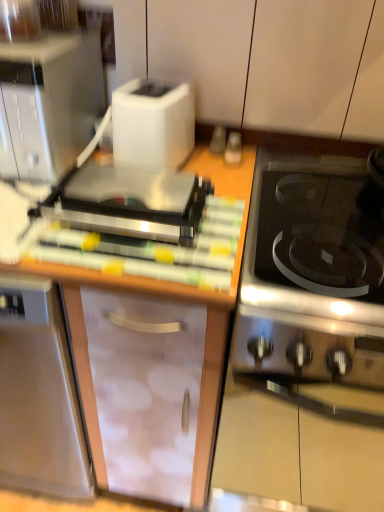
At what (x,y) coordinates should I click in order to perform the action: click on free location to the right of white plastic toaster at upper center. Please return your answer as a coordinate pair (x, y). Image resolution: width=384 pixels, height=512 pixels. Looking at the image, I should click on (216, 166).